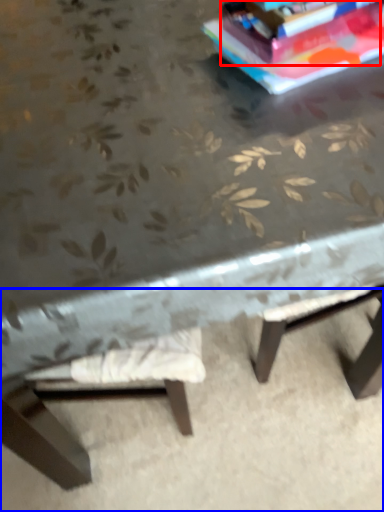
Question: Which object is further to the camera taking this photo, paperback book (highlighted by a red box) or concrete (highlighted by a blue box)?

Choices:
 (A) paperback book
 (B) concrete

Answer: (B)